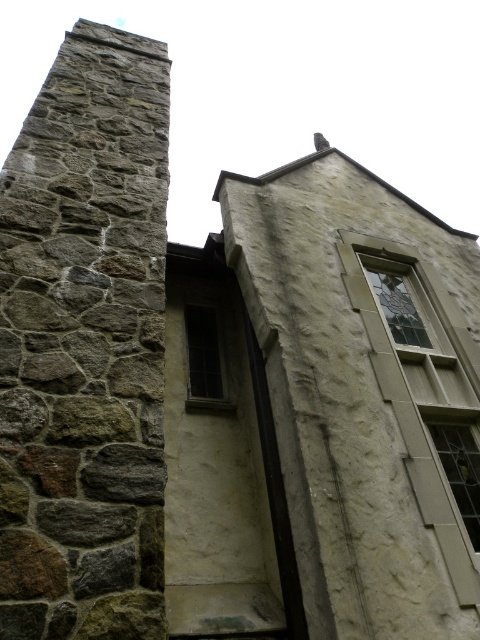
You are standing in front of the building and notice two points marked on its exterior. The first point is at coordinate point (122, 266) and the second is at coordinate point (447, 477). Which point is closer to you?

Point (122, 266) is in front of point (447, 477), so it is closer to you.